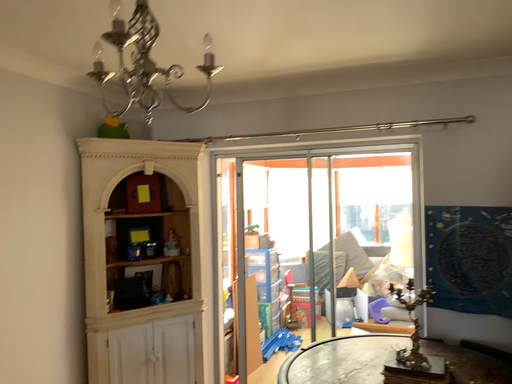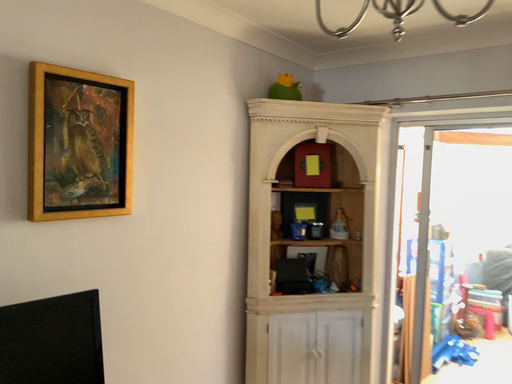
Question: Which way did the camera rotate in the video?

Choices:
 (A) rotated right
 (B) rotated left

Answer: (B)